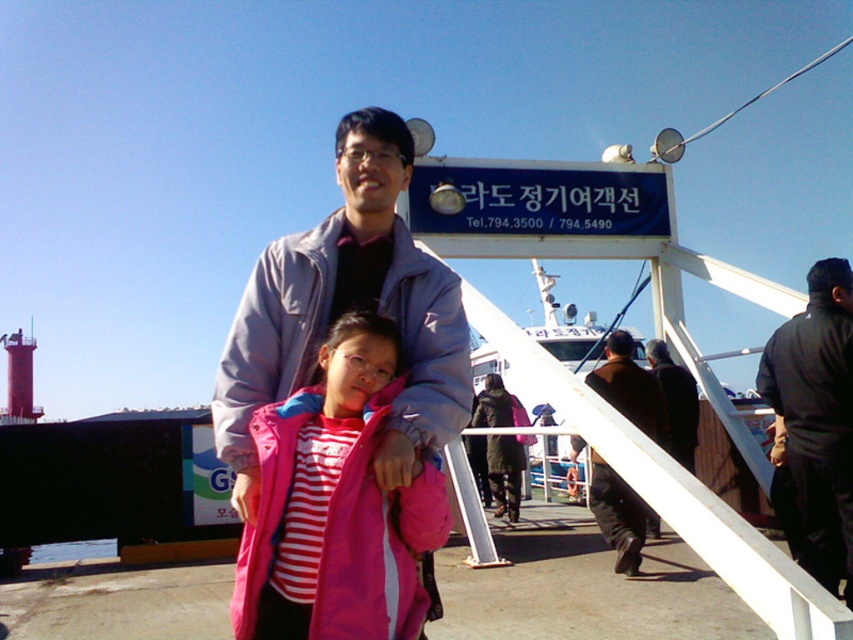
Who is positioned more to the left, black matte jacket at upper right or brown wool coat at center?

Positioned to the left is brown wool coat at center.

Between black matte jacket at upper right and brown wool coat at center, which one appears on the right side from the viewer's perspective?

black matte jacket at upper right

The width and height of the screenshot is (853, 640). Describe the element at coordinates (817, 417) in the screenshot. I see `black matte jacket at upper right` at that location.

You are a GUI agent. You are given a task and a screenshot of the screen. Output one action in this format:
    pyautogui.click(x=<x>, y=<y>)
    Task: Click on the black matte jacket at upper right
    The image size is (853, 640).
    Given the screenshot: What is the action you would take?
    pyautogui.click(x=817, y=417)

What do you see at coordinates (817, 417) in the screenshot? I see `black matte jacket at upper right` at bounding box center [817, 417].

Is black matte jacket at upper right closer to the viewer compared to dark brown leather jacket at center?

Yes, it is in front of dark brown leather jacket at center.

The height and width of the screenshot is (640, 853). Find the location of `black matte jacket at upper right`. black matte jacket at upper right is located at coordinates (817, 417).

Where is `pink fabric jacket at center`? Image resolution: width=853 pixels, height=640 pixels. pink fabric jacket at center is located at coordinates (335, 506).

Between point (328, 541) and point (671, 416), which one is positioned in front?

Point (328, 541) is in front.

This screenshot has width=853, height=640. I want to click on pink fabric jacket at center, so click(335, 506).